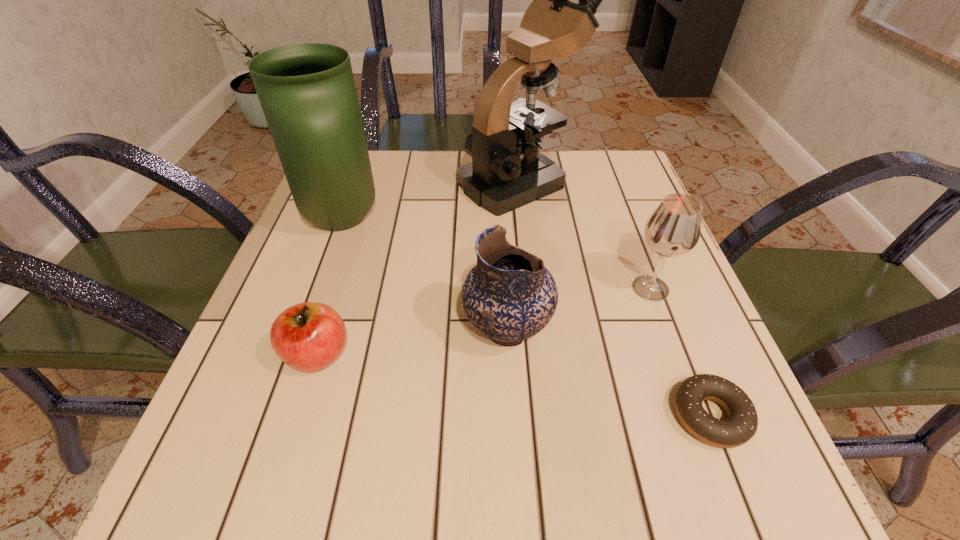
Locate an element on the screen. The width and height of the screenshot is (960, 540). doughnut that is at the right edge is located at coordinates (741, 425).

Where is `object situated at the far left corner`? object situated at the far left corner is located at coordinates (307, 92).

Find the location of a particular element. The width and height of the screenshot is (960, 540). object located in the far right corner section of the desktop is located at coordinates (507, 171).

This screenshot has width=960, height=540. I want to click on object present at the near right corner, so click(x=741, y=425).

In the image, there is a desktop. In order to click on vacant space at the far edge in this screenshot , I will do `click(457, 169)`.

What are the coordinates of `vacant space at the near edge of the desktop` in the screenshot? It's located at (645, 476).

Locate an element on the screen. This screenshot has width=960, height=540. vacant space at the left edge of the desktop is located at coordinates (335, 307).

Find the location of a particular element. vacant point at the right edge is located at coordinates (667, 303).

Image resolution: width=960 pixels, height=540 pixels. Identify the location of free space at the far right corner. (574, 152).

This screenshot has width=960, height=540. Find the location of `free space between the apple and the shortest object`. free space between the apple and the shortest object is located at coordinates (514, 386).